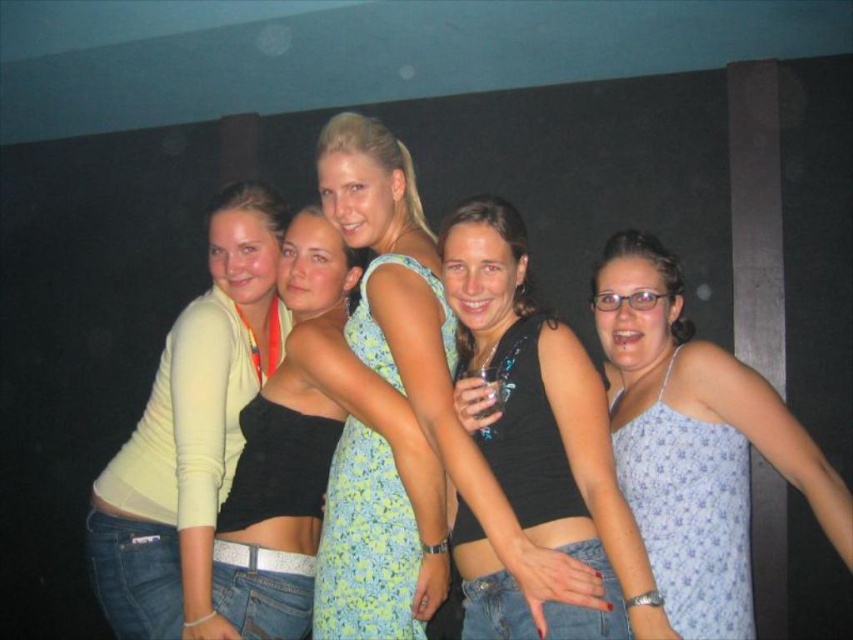
Who is higher up, floral dress at center or black sequined tank top at center?

floral dress at center

Who is shorter, floral dress at center or black sequined tank top at center?

Standing shorter between the two is black sequined tank top at center.

Is point (593, 584) behind point (531, 509)?

No.

This screenshot has height=640, width=853. What are the coordinates of `floral dress at center` in the screenshot? It's located at (425, 340).

Does black sequined tank top at center have a greater height compared to light blue floral dress at center?

Incorrect, black sequined tank top at center's height is not larger of light blue floral dress at center's.

Does point (489, 438) lie behind point (317, 419)?

No, it is not.

Is point (491, 200) more distant than point (248, 492)?

No, (491, 200) is closer to viewer.

Find the location of a particular element. The height and width of the screenshot is (640, 853). black sequined tank top at center is located at coordinates (544, 422).

Who is positioned more to the right, floral dress at center or light yellow long-sleeve shirt at left?

From the viewer's perspective, floral dress at center appears more on the right side.

Does floral dress at center have a smaller size compared to light yellow long-sleeve shirt at left?

No.

Image resolution: width=853 pixels, height=640 pixels. Find the location of `floral dress at center`. floral dress at center is located at coordinates (425, 340).

Image resolution: width=853 pixels, height=640 pixels. Identify the location of floral dress at center. (425, 340).